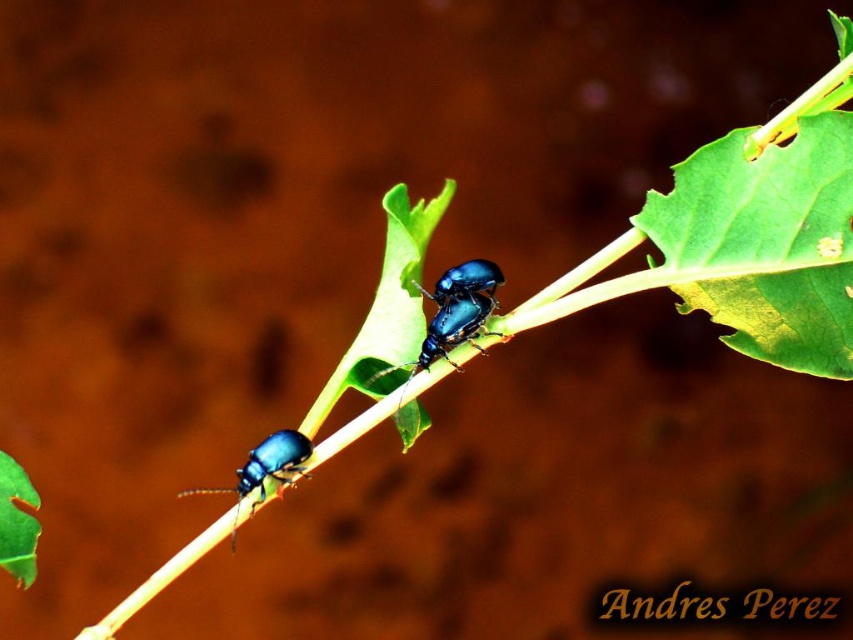
Is metallic blue beetle at lower left bigger than metallic blue beetle at center?

Correct, metallic blue beetle at lower left is larger in size than metallic blue beetle at center.

Who is more distant from viewer, (297, 467) or (486, 282)?

Point (486, 282)

Identify the location of metallic blue beetle at lower left. This screenshot has width=853, height=640. (264, 470).

Which is behind, point (846, 280) or point (257, 449)?

The point (257, 449) is more distant.

Is green matte leaf at upper right closer to the viewer compared to metallic blue beetle at lower left?

Yes, it is in front of metallic blue beetle at lower left.

Between point (842, 237) and point (305, 442), which one is positioned in front?

Positioned in front is point (842, 237).

This screenshot has height=640, width=853. Find the location of `green matte leaf at upper right`. green matte leaf at upper right is located at coordinates (766, 243).

The width and height of the screenshot is (853, 640). What are the coordinates of `green matte leaf at upper right` in the screenshot? It's located at (766, 243).

Who is more distant from viewer, (814,362) or (434,292)?

The point (434,292) is more distant.

The width and height of the screenshot is (853, 640). I want to click on green matte leaf at upper right, so click(x=766, y=243).